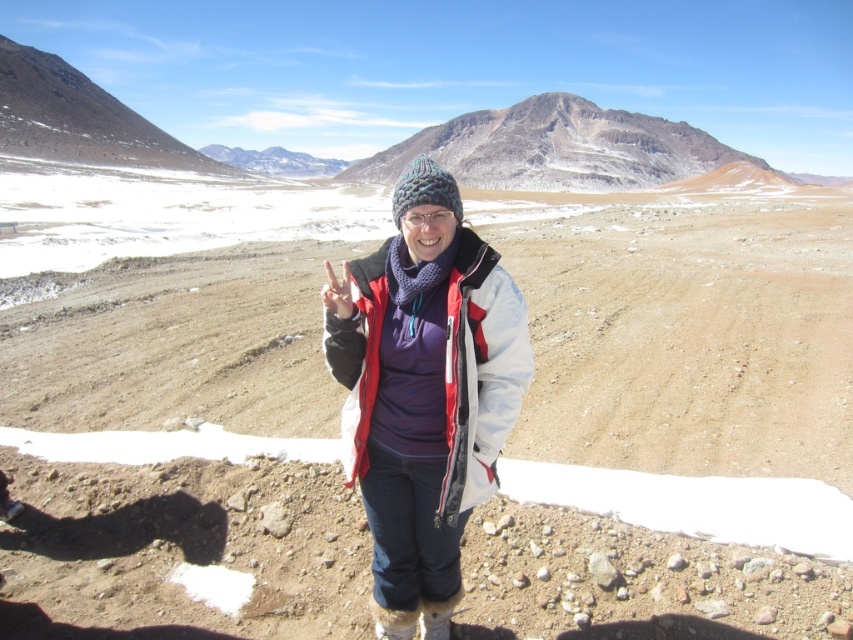
Does matte white jacket at center appear over rugged stone mountain at center?

Actually, matte white jacket at center is below rugged stone mountain at center.

Who is higher up, matte white jacket at center or rugged stone mountain at center?

rugged stone mountain at center

Who is more forward, (482, 296) or (482, 168)?

Positioned in front is point (482, 296).

Locate an element on the screen. The height and width of the screenshot is (640, 853). matte white jacket at center is located at coordinates (479, 371).

Between point (265, 605) and point (538, 170), which one is positioned behind?

The point (538, 170) is behind.

Consider the image. Who is lower down, brown dirt at center or rugged stone mountain at center?

brown dirt at center is below.

The image size is (853, 640). Find the location of `brown dirt at center`. brown dirt at center is located at coordinates (672, 420).

At what (x,y) coordinates should I click in order to perform the action: click on brown dirt at center. Please return your answer as a coordinate pair (x, y). This screenshot has height=640, width=853. Looking at the image, I should click on (672, 420).

Consider the image. Does brown dirt at center have a greater width compared to matte white jacket at center?

Yes.

Can you confirm if brown dirt at center is positioned below matte white jacket at center?

Actually, brown dirt at center is above matte white jacket at center.

The image size is (853, 640). What do you see at coordinates (672, 420) in the screenshot?
I see `brown dirt at center` at bounding box center [672, 420].

You are a GUI agent. You are given a task and a screenshot of the screen. Output one action in this format:
    pyautogui.click(x=<x>, y=<y>)
    Task: Click on the brown dirt at center
    This screenshot has width=853, height=640.
    Given the screenshot: What is the action you would take?
    pyautogui.click(x=672, y=420)